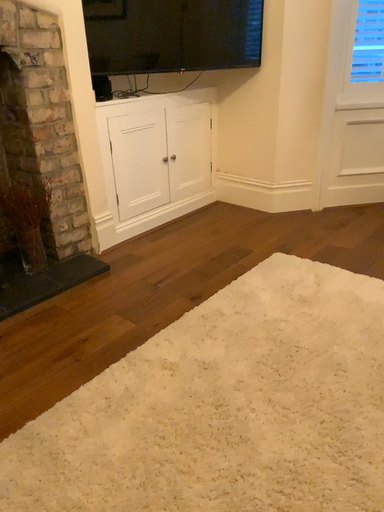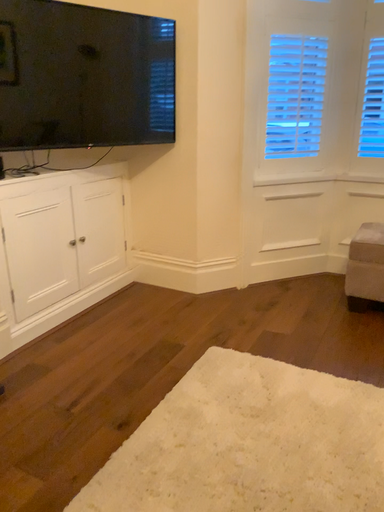
Question: Which way did the camera rotate in the video?

Choices:
 (A) rotated upward
 (B) rotated downward

Answer: (A)